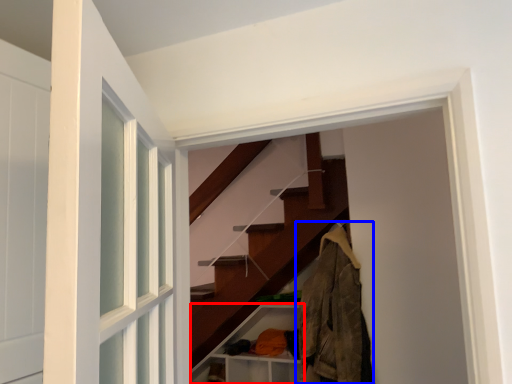
Question: Which of the following is the farthest to the observer, cabinet (highlighted by a red box) or clothing (highlighted by a blue box)?

Choices:
 (A) cabinet
 (B) clothing

Answer: (A)